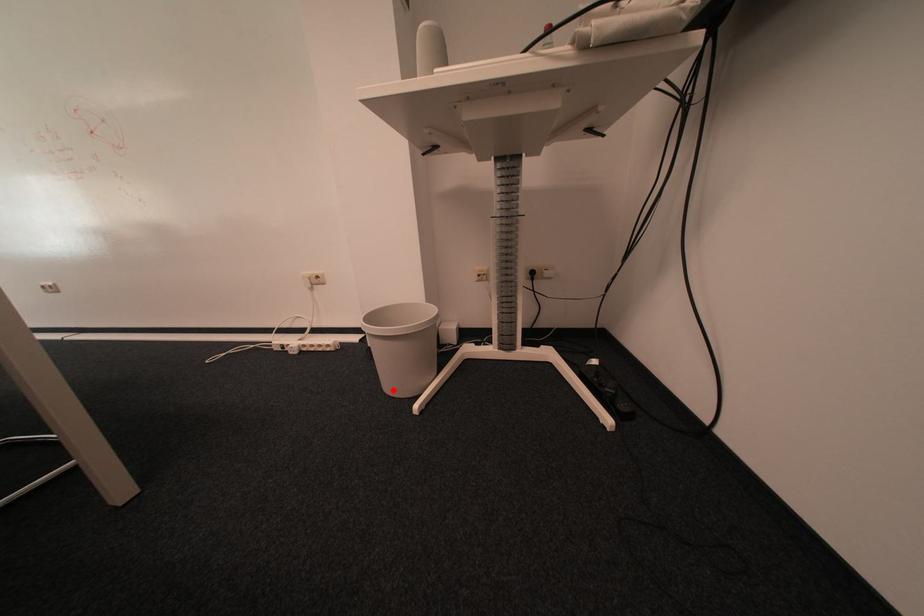
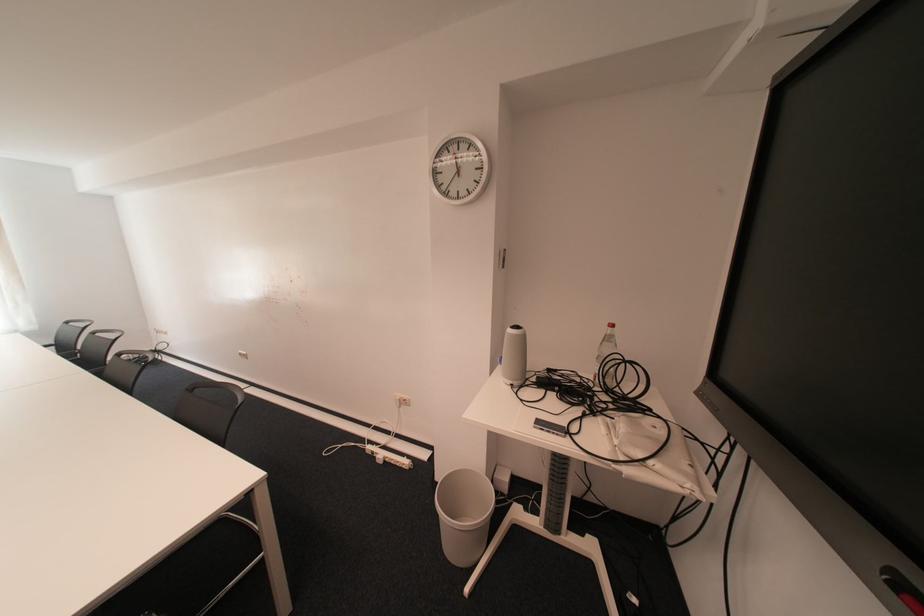
Locate, in the second image, the point that corresponds to the highlighted location in the first image.

(453, 546)